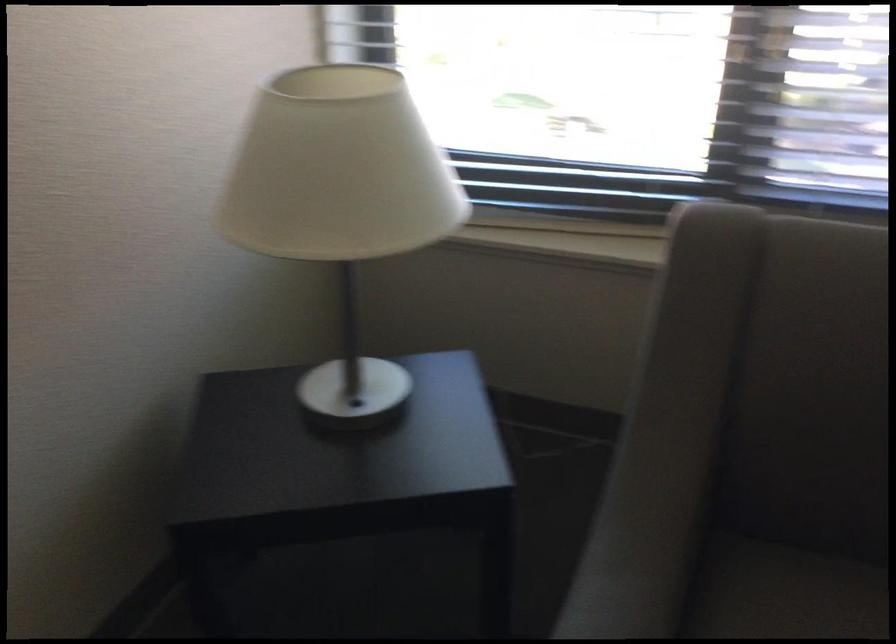
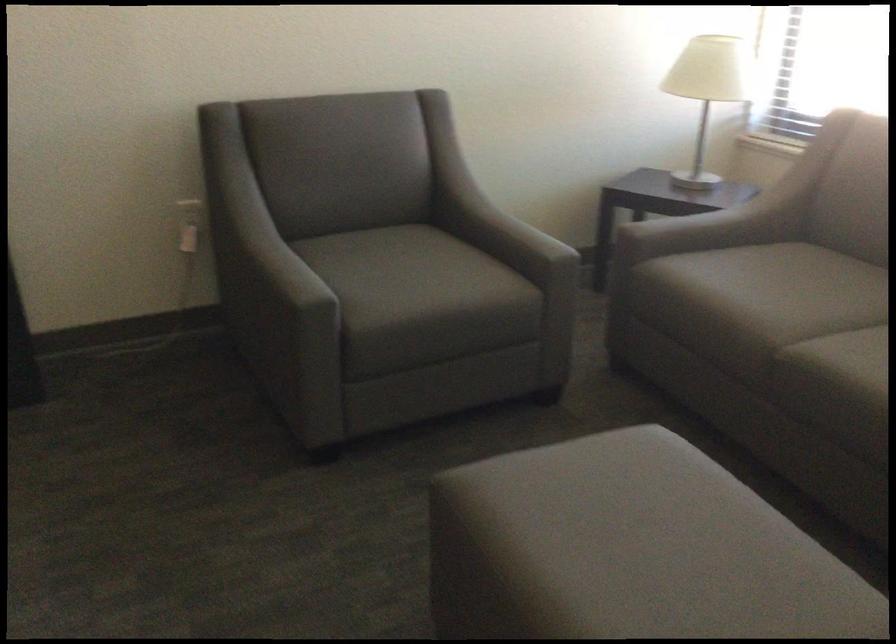
Locate, in the second image, the point that corresponds to pixel 375 250 in the first image.

(708, 90)